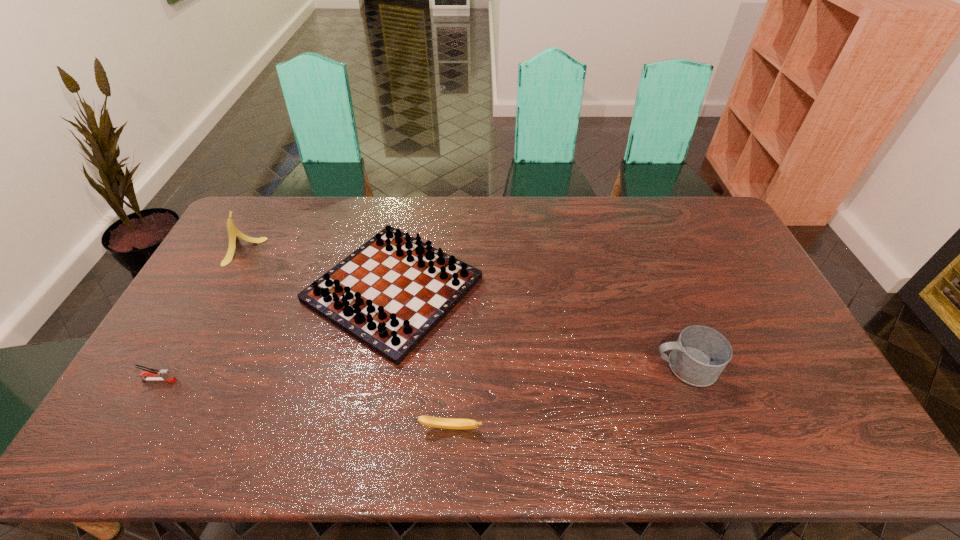
Locate an element on the screen. the tallest object is located at coordinates (233, 233).

You are a GUI agent. You are given a task and a screenshot of the screen. Output one action in this format:
    pyautogui.click(x=<x>, y=<y>)
    Task: Click on the left banana
    Image resolution: width=960 pixels, height=540 pixels.
    Given the screenshot: What is the action you would take?
    pyautogui.click(x=233, y=233)

Image resolution: width=960 pixels, height=540 pixels. I want to click on chessboard, so click(389, 294).

At what (x,y) coordinates should I click in order to perform the action: click on the rightmost object. Please return your answer as a coordinate pair (x, y). The width and height of the screenshot is (960, 540). Looking at the image, I should click on (701, 353).

Identify the location of stapler. Image resolution: width=960 pixels, height=540 pixels. (150, 374).

Locate an element on the screen. Image resolution: width=960 pixels, height=540 pixels. the nearer banana is located at coordinates (x=445, y=423).

Identify the location of the nearest object. Image resolution: width=960 pixels, height=540 pixels. (445, 423).

Locate an element on the screen. vacant region located 0.090m on the front of the taller banana is located at coordinates (221, 286).

Where is `free space located 0.090m on the right of the chessboard`? free space located 0.090m on the right of the chessboard is located at coordinates (510, 289).

Locate an element on the screen. free space located 0.210m on the side of the mug with the handle is located at coordinates (576, 367).